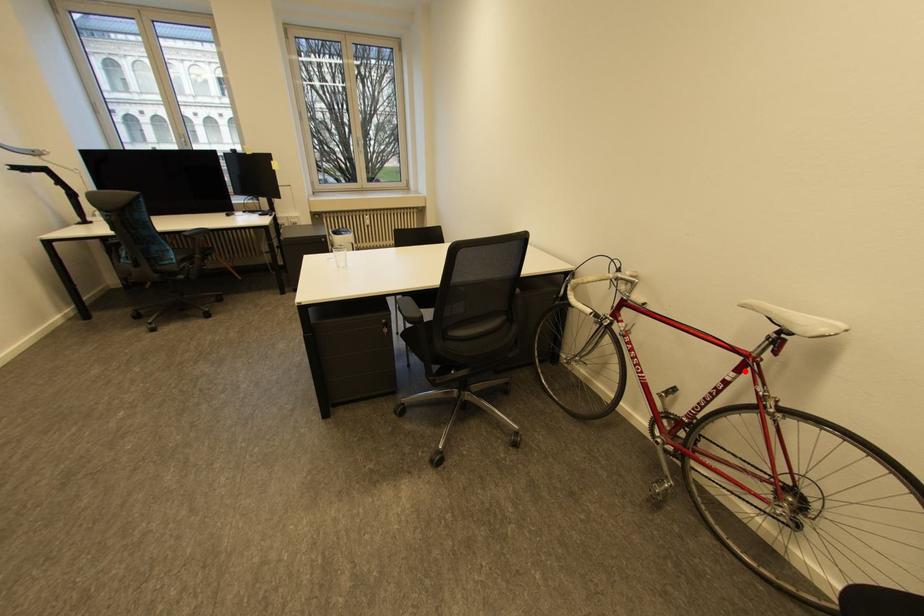
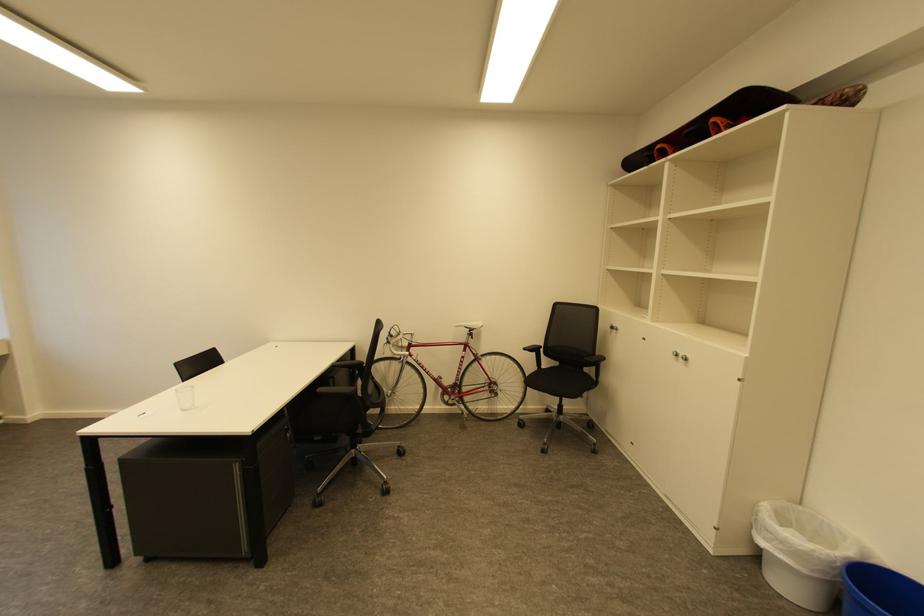
Question: A red point is marked in image1. In image2, is the corresponding 3D point closer to the camera or farther? Reply with the corresponding letter.

Choices:
 (A) The corresponding 3D point is closer.
 (B) The corresponding 3D point is farther.

Answer: (B)